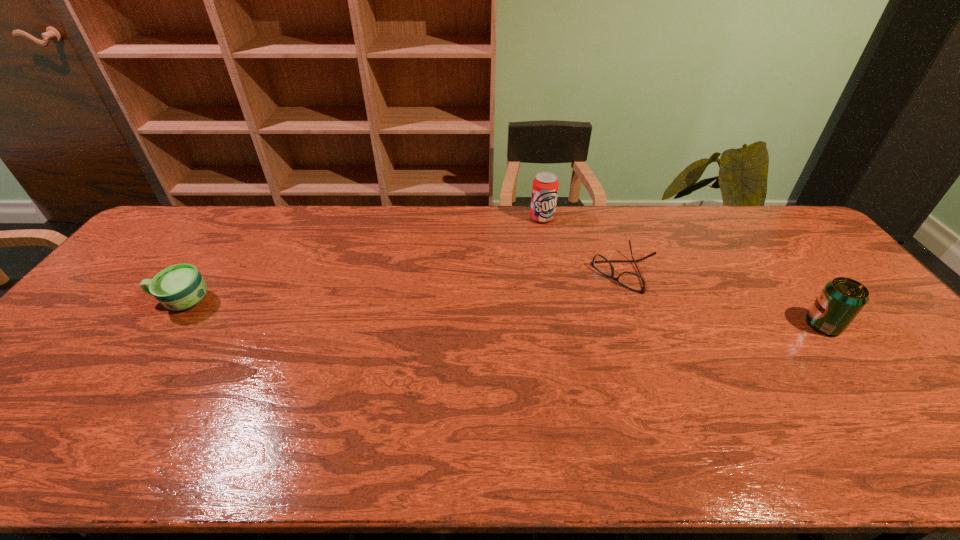
You are a GUI agent. You are given a task and a screenshot of the screen. Output one action in this format:
    pyautogui.click(x=<x>, y=<y>)
    Task: Click on the free space on the desktop that is between the third tallest object and the beer can and is positioned on the surface of the farthest object
    The height and width of the screenshot is (540, 960).
    Given the screenshot: What is the action you would take?
    pyautogui.click(x=566, y=316)

The width and height of the screenshot is (960, 540). I want to click on vacant spot on the desktop that is between the leftmost object and the second tallest object and is positioned on the front-facing side of the third object from left to right, so click(572, 316).